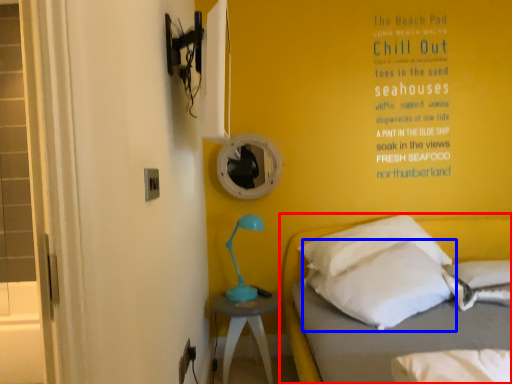
Question: Among these objects, which one is farthest to the camera, bed (highlighted by a red box) or pillow (highlighted by a blue box)?

Choices:
 (A) bed
 (B) pillow

Answer: (B)